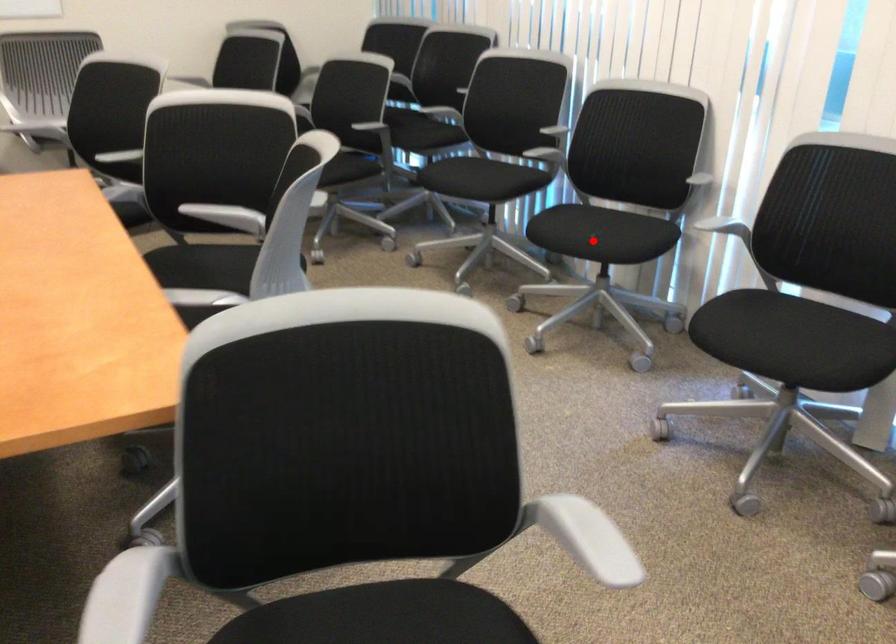
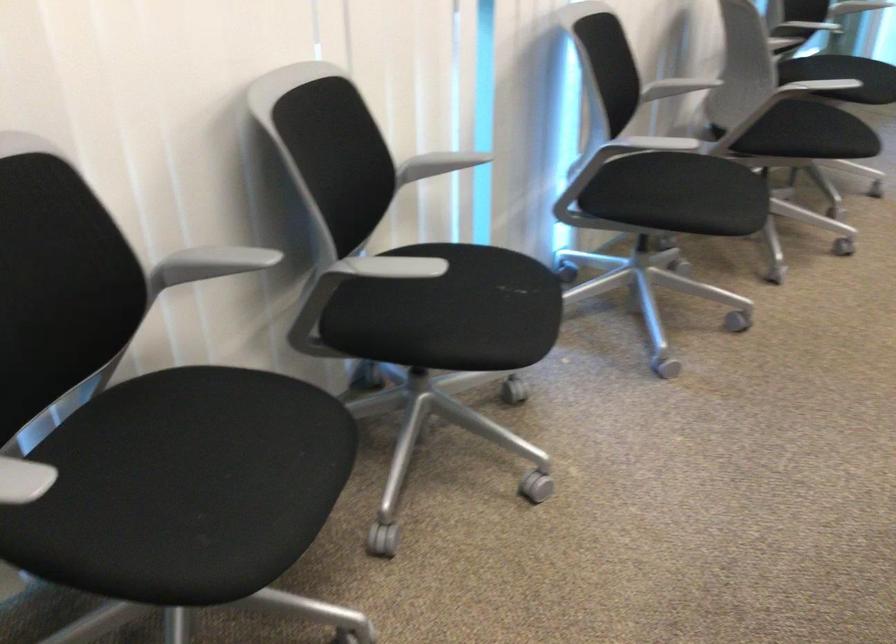
In the second image, find the point that corresponds to the highlighted location in the first image.

(515, 287)